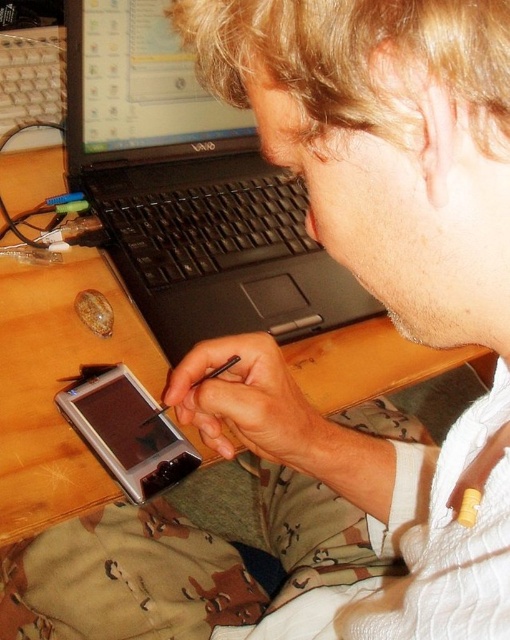
Who is shorter, black plastic laptop at upper center or satin black smartphone at lower center?

satin black smartphone at lower center is shorter.

Between black plastic laptop at upper center and satin black smartphone at lower center, which one appears on the left side from the viewer's perspective?

From the viewer's perspective, satin black smartphone at lower center appears more on the left side.

Identify the location of black plastic laptop at upper center. Image resolution: width=510 pixels, height=640 pixels. (189, 189).

Does wooden table at center have a greater width compared to satin black smartphone at lower center?

Correct, the width of wooden table at center exceeds that of satin black smartphone at lower center.

Between wooden table at center and satin black smartphone at lower center, which one is positioned lower?

satin black smartphone at lower center

Which is in front, point (4, 456) or point (165, 465)?

Point (4, 456)

Locate an element on the screen. wooden table at center is located at coordinates (57, 387).

Is black plastic laptop at upper center above wooden table at center?

Correct, black plastic laptop at upper center is located above wooden table at center.

Does black plastic laptop at upper center come behind wooden table at center?

Yes, black plastic laptop at upper center is behind wooden table at center.

Does point (142, 230) lie behind point (40, 380)?

Yes, point (142, 230) is farther from viewer.

Find the location of a particular element. black plastic laptop at upper center is located at coordinates (189, 189).